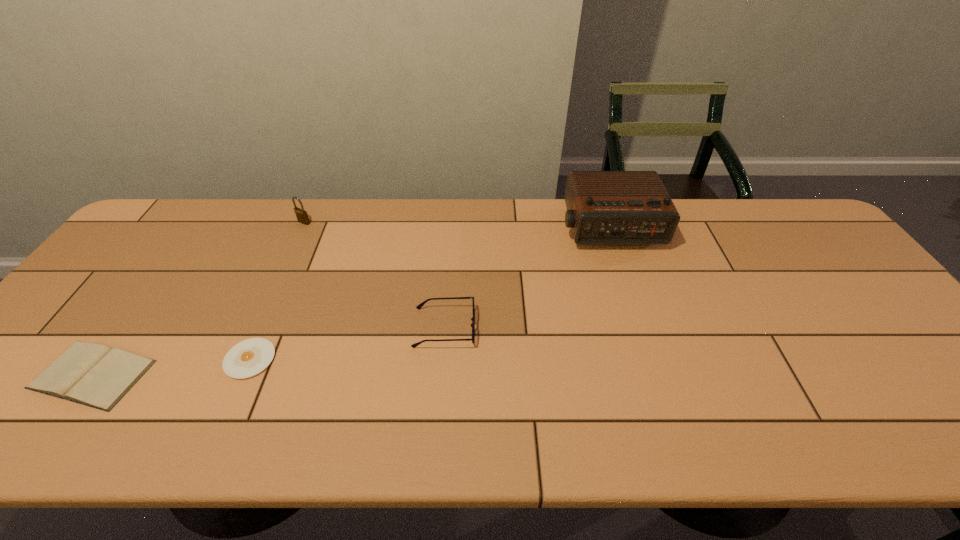
Identify the location of vacant space located on the front-facing side of the third tallest object. This screenshot has height=540, width=960. (595, 328).

I want to click on free space located on the back of the second shortest object, so click(134, 315).

Where is `vacant area situated on the right of the shortest object`? The image size is (960, 540). vacant area situated on the right of the shortest object is located at coordinates (441, 359).

In order to click on radio receiver located in the far edge section of the desktop in this screenshot , I will do `click(603, 207)`.

The height and width of the screenshot is (540, 960). In order to click on padlock present at the far edge in this screenshot , I will do `click(302, 216)`.

At what (x,y) coordinates should I click in order to perform the action: click on object positioned at the near edge. Please return your answer as a coordinate pair (x, y). This screenshot has height=540, width=960. Looking at the image, I should click on (95, 375).

Where is `object located in the left edge section of the desktop`? This screenshot has width=960, height=540. object located in the left edge section of the desktop is located at coordinates (95, 375).

Where is `object that is positioned at the near left corner`? Image resolution: width=960 pixels, height=540 pixels. object that is positioned at the near left corner is located at coordinates (95, 375).

In the image, there is a desktop. Identify the location of vacant space at the far edge. The width and height of the screenshot is (960, 540). click(253, 224).

What are the coordinates of `vacant space at the near edge` in the screenshot? It's located at (542, 430).